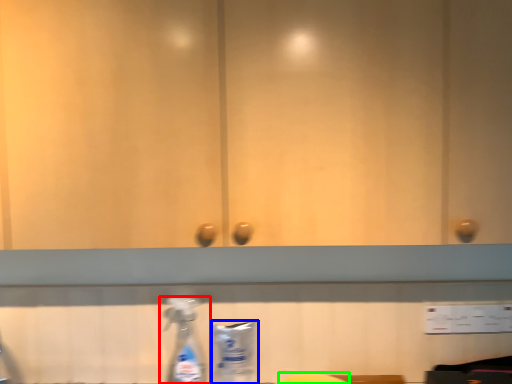
Question: Considering the real-world distances, which object is farthest from bottle (highlighted by a red box)? cleaning product (highlighted by a blue box) or wide (highlighted by a green box)?

Choices:
 (A) cleaning product
 (B) wide

Answer: (B)